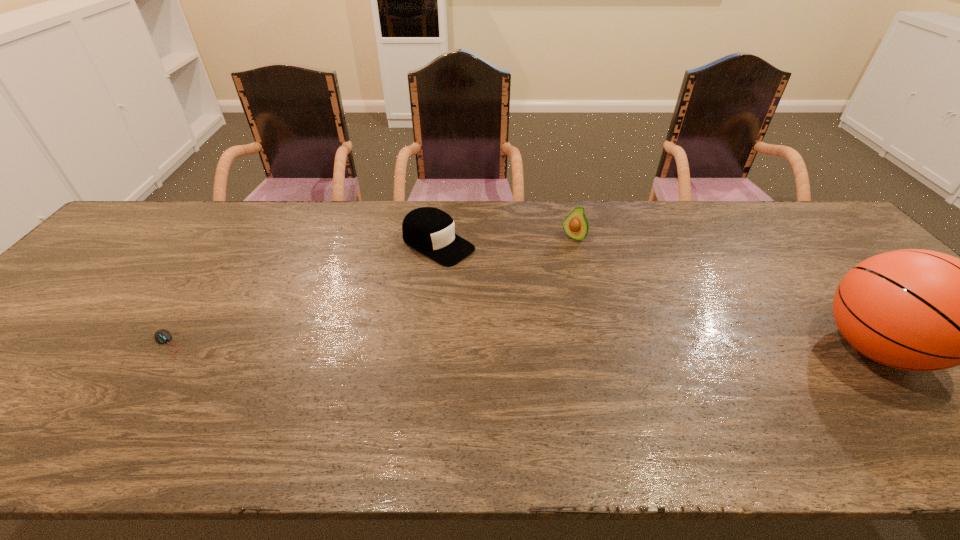
The image size is (960, 540). I want to click on the shortest object, so click(161, 336).

This screenshot has height=540, width=960. I want to click on mouse, so click(161, 336).

Where is `avocado`? avocado is located at coordinates (575, 225).

Where is `the third object from left to right`? the third object from left to right is located at coordinates (575, 225).

At what (x,y) coordinates should I click in order to perform the action: click on cap. Please return your answer as a coordinate pair (x, y). The width and height of the screenshot is (960, 540). Looking at the image, I should click on (431, 231).

Where is `the third object from right to left`? the third object from right to left is located at coordinates (431, 231).

Locate an element on the screen. This screenshot has width=960, height=540. vacant region located 0.140m on the left of the leftmost object is located at coordinates (88, 345).

Where is `vacant region located 0.250m on the cut side of the third object from left to right`? Image resolution: width=960 pixels, height=540 pixels. vacant region located 0.250m on the cut side of the third object from left to right is located at coordinates (528, 291).

Find the location of a particular element. The height and width of the screenshot is (540, 960). vacant space located 0.080m on the cut side of the third object from left to right is located at coordinates (557, 256).

Where is `vacant point located on the cut side of the third object from left to right`? The image size is (960, 540). vacant point located on the cut side of the third object from left to right is located at coordinates (x=558, y=255).